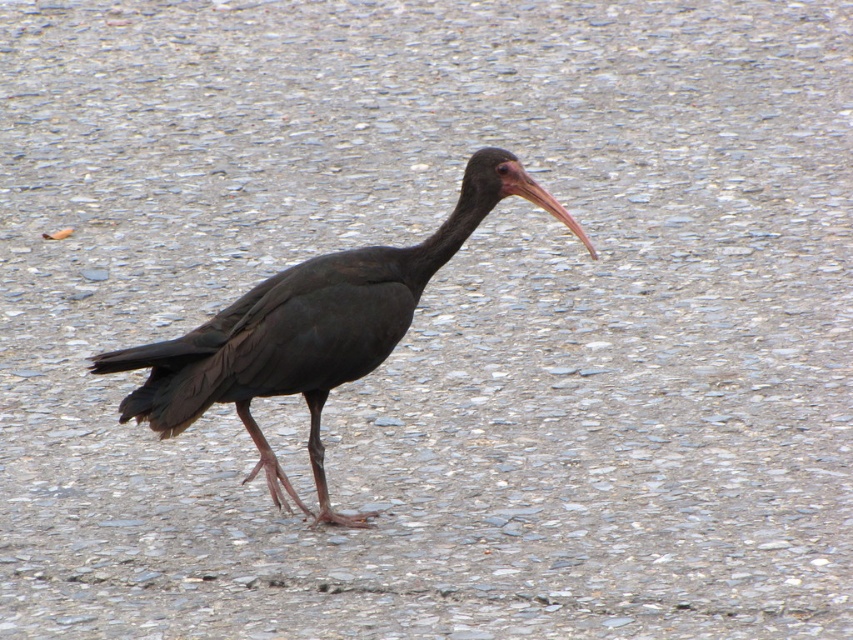
You are a photographer aiming to capture the ibis in the center of the image. Given that the ibis is represented by the point at coordinates point (303, 336), can you confirm if this point lies exactly at the geometric center of the image?

The shiny black bird at center is represented by point (303, 336), so yes, the point lies exactly at the geometric center of the image.

You are a photographer trying to capture the shiny black bird at center and the matte pink beak at center in a single shot. Based on their positions, which object is closer to the left edge of your camera frame?

The shiny black bird at center is positioned on the left side of the matte pink beak at center, so it is closer to the left edge of the camera frame.

You are a photographer trying to capture the shiny black bird at center and the matte pink beak at center in a single shot. Based on their positions, which object should you focus on first to ensure both are in sharp focus?

The shiny black bird at center is located below the matte pink beak at center. To ensure both are in sharp focus, you should focus on the shiny black bird at center first since it is closer to the camera, and the matte pink beak at center will naturally fall into the depth of field if focused on the closer object.